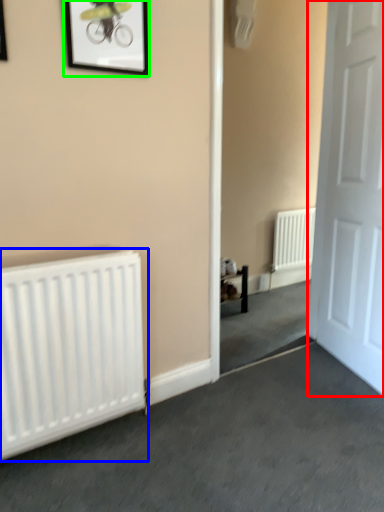
Question: Considering the real-world distances, which object is farthest from door (highlighted by a red box)? radiator (highlighted by a blue box) or picture frame (highlighted by a green box)?

Choices:
 (A) radiator
 (B) picture frame

Answer: (A)